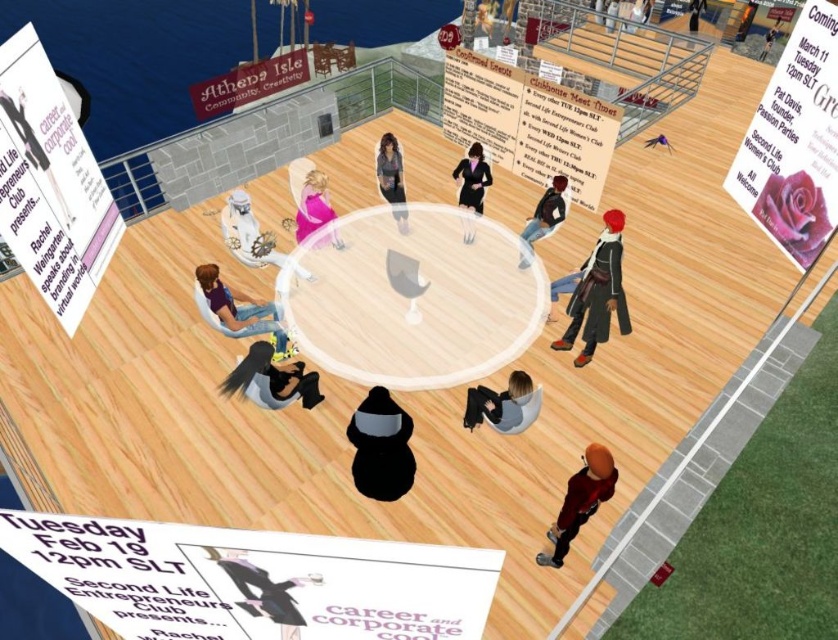
Question: Is black hair at lower center smaller than matte gray chair at lower center?

Choices:
 (A) yes
 (B) no

Answer: (B)

Question: Which of these objects is positioned closest to the shiny black hair at upper center?

Choices:
 (A) matte gray chair at lower center
 (B) shiny red jacket at lower right

Answer: (A)

Question: Is black hair at lower center thinner than matte pink dress at center?

Choices:
 (A) no
 (B) yes

Answer: (A)

Question: In this image, where is black matte figure at center located relative to matte pink dress at center?

Choices:
 (A) left
 (B) right

Answer: (B)

Question: Among these points, which one is nearest to the camera?

Choices:
 (A) (661, 134)
 (B) (555, 525)

Answer: (B)

Question: Which point is farther to the camera?

Choices:
 (A) shiny black hair at upper center
 (B) shiny red jacket at lower right
 (C) black hair at lower center
 (D) black matte figure at center

Answer: (A)